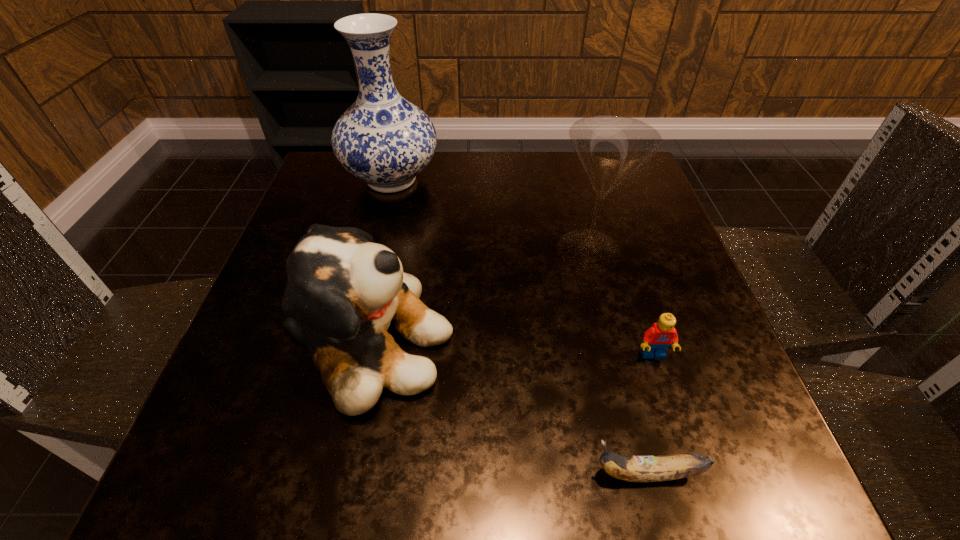
Find the location of a particular element. the farthest object is located at coordinates (383, 139).

The height and width of the screenshot is (540, 960). What are the coordinates of `the tallest object` in the screenshot? It's located at (383, 139).

Find the location of a particular element. The height and width of the screenshot is (540, 960). flute glass is located at coordinates (611, 147).

I want to click on puppy, so click(x=347, y=291).

This screenshot has width=960, height=540. Identify the location of Lego. (657, 339).

Locate an element on the screen. the shortest object is located at coordinates pyautogui.click(x=668, y=467).

Locate an element on the screen. banana is located at coordinates (668, 467).

Image resolution: width=960 pixels, height=540 pixels. Find the location of `vacant space located on the front of the farthest object`. vacant space located on the front of the farthest object is located at coordinates (368, 277).

I want to click on free space located on the left of the fourth nearest object, so click(x=393, y=249).

This screenshot has width=960, height=540. Find the location of `free space located 0.270m at the face of the puppy`. free space located 0.270m at the face of the puppy is located at coordinates (617, 345).